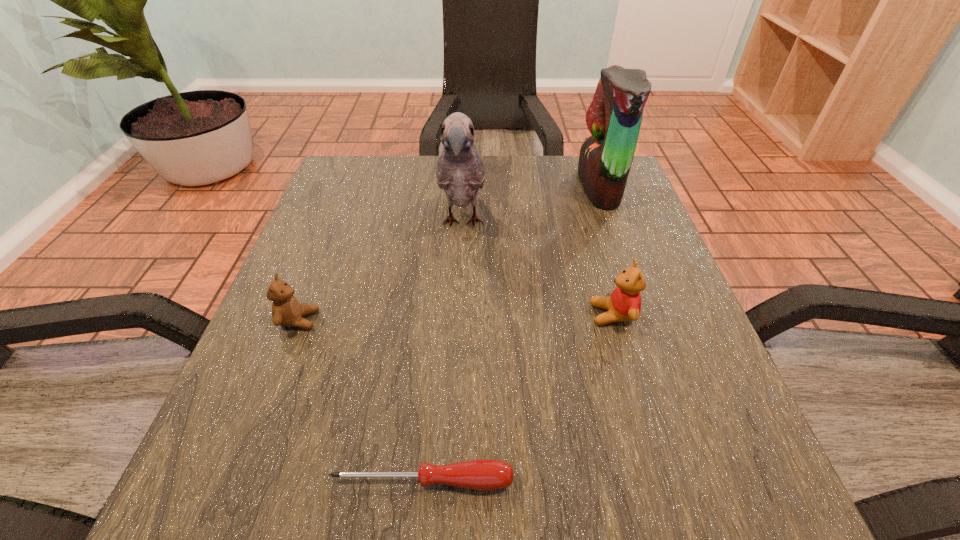
Find the location of a particular element. blank space located 0.280m on the front-facing side of the left parrot is located at coordinates (455, 378).

Where is `free location located 0.390m on the front-facing side of the right teddy bear`? free location located 0.390m on the front-facing side of the right teddy bear is located at coordinates (x=370, y=315).

Where is `free region located on the front-facing side of the right teddy bear`? The image size is (960, 540). free region located on the front-facing side of the right teddy bear is located at coordinates (421, 315).

The image size is (960, 540). What are the coordinates of `vacant space located on the front-facing side of the right teddy bear` in the screenshot? It's located at (535, 315).

I want to click on free space located on the front-facing side of the fourth tallest object, so click(x=518, y=320).

At what (x,y) coordinates should I click in order to perform the action: click on vacant region located on the back of the shortest object. Please return your answer as a coordinate pair (x, y). Image resolution: width=960 pixels, height=540 pixels. Looking at the image, I should click on (429, 406).

Find the location of a particular element. This screenshot has width=960, height=540. object that is positioned at the near edge is located at coordinates (484, 474).

At what (x,y) coordinates should I click in order to perform the action: click on object present at the left edge. Please return your answer as a coordinate pair (x, y). This screenshot has width=960, height=540. Looking at the image, I should click on (286, 310).

Locate an element on the screen. parrot positioned at the right edge is located at coordinates (614, 117).

At what (x,y) coordinates should I click in order to perform the action: click on teddy bear that is at the right edge. Please return your answer as a coordinate pair (x, y). Looking at the image, I should click on (624, 304).